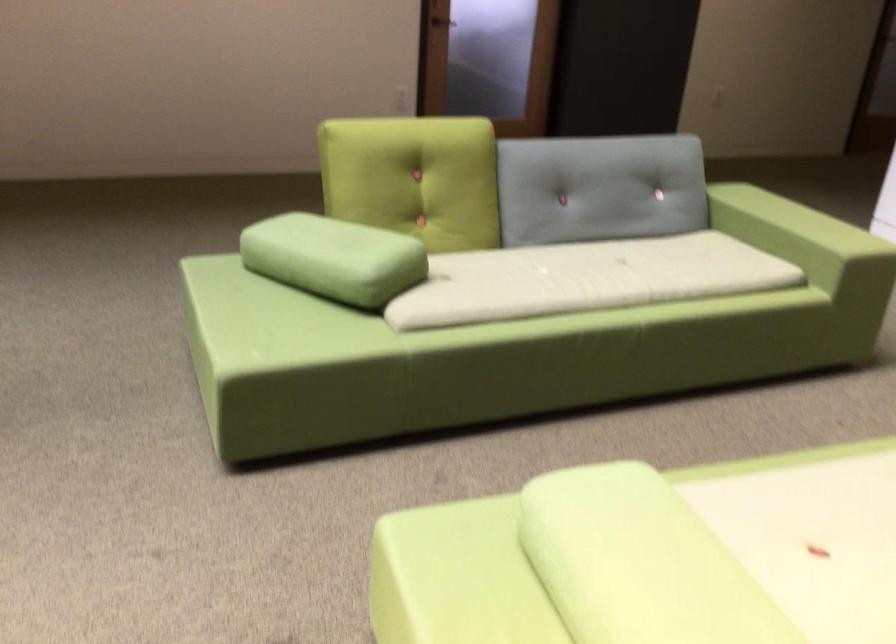
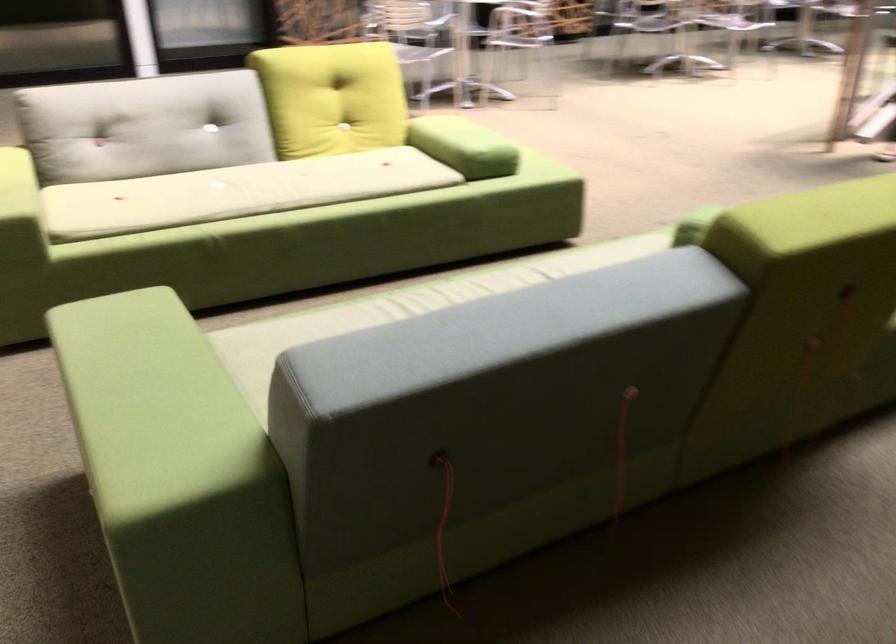
In the second image, find the point that corresponds to point 403,248 in the first image.

(694, 225)